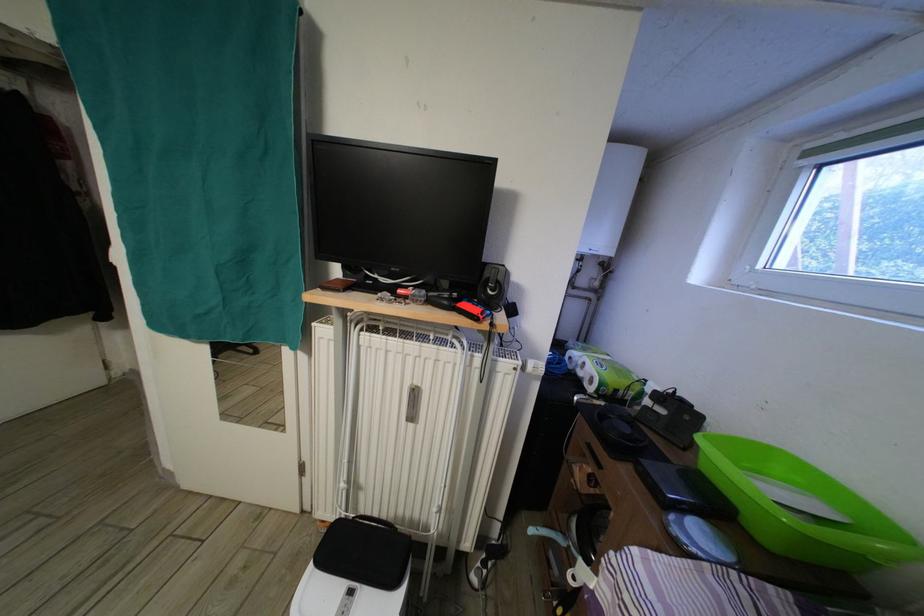
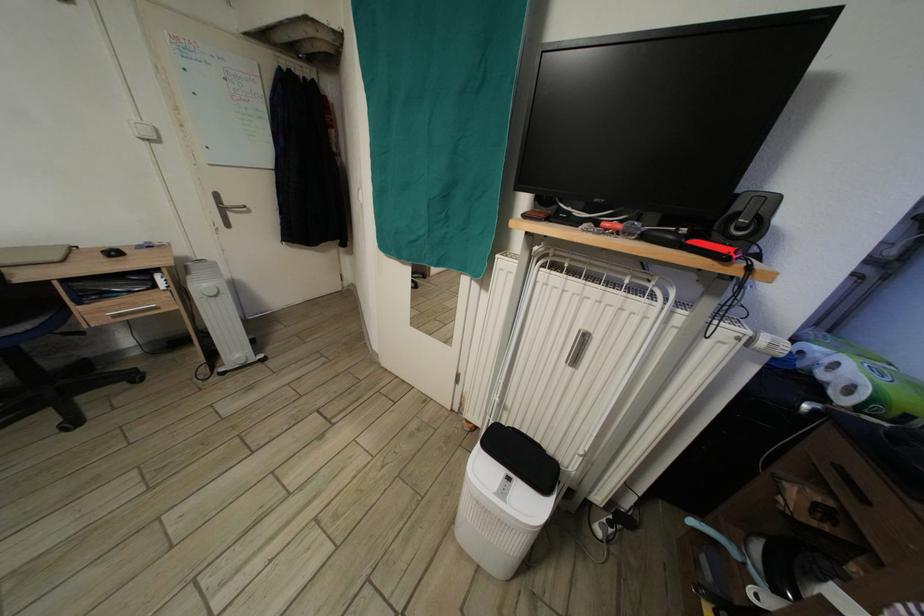
Locate, in the second image, the point that corresponds to point (493, 281) in the first image.

(744, 214)